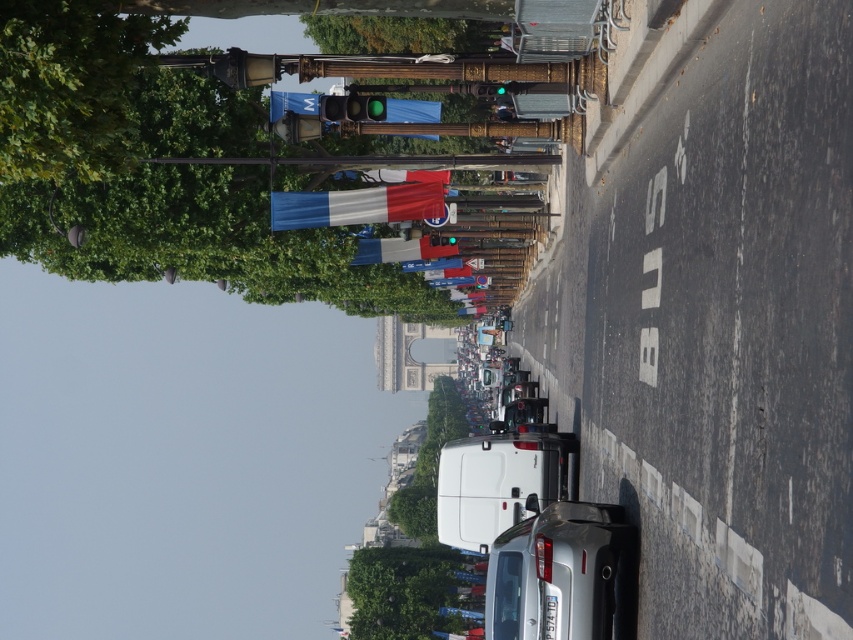
You are a tourist in Paris and see the tricolor fabric flag at center and the matte fabric flag at center near the traffic light. Which flag is closer to the left side of the road?

The tricolor fabric flag at center is closer to the left side of the road since it is to the left of the matte fabric flag at center.

You are a delivery driver who needs to park your truck, which is 2 meters wide, on the white asphalt road at center. Considering the green leafy tree at lower center, will there be enough space to park your truck without hitting the tree?

The white asphalt road at center has a lesser width compared to the green leafy tree at lower center. Since the truck is 2 meters wide, the road may not be wide enough to park without potentially encroaching on the space near the tree. It is advisable to look for another parking spot.

Looking at this image, you are a tourist in Paris and see the satin silver car at center and the tricolor fabric flag at center in the image. Which object appears bigger to you?

The satin silver car at center is larger in size than the tricolor fabric flag at center, so the car appears bigger.